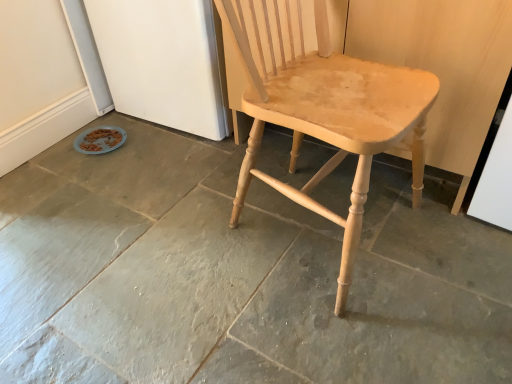
Where is `free location in front of natural wood chair at center`? This screenshot has width=512, height=384. free location in front of natural wood chair at center is located at coordinates (343, 338).